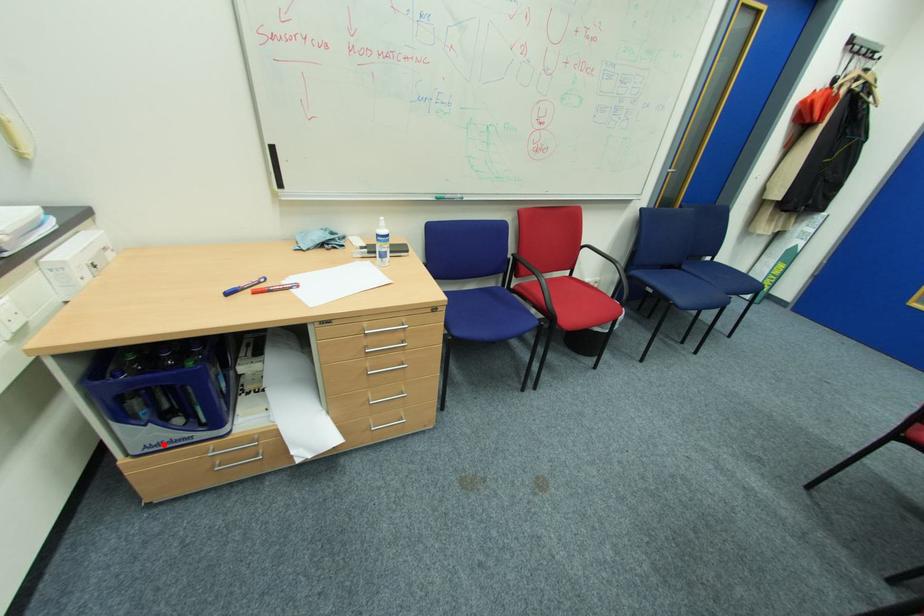
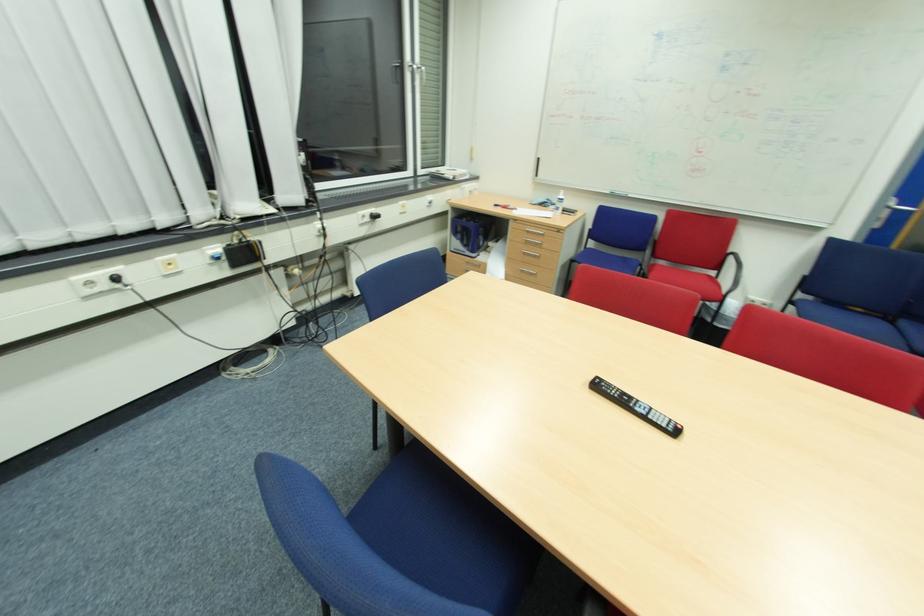
The point at the highlighted location is marked in the first image. Where is the corresponding point in the second image?

(462, 249)